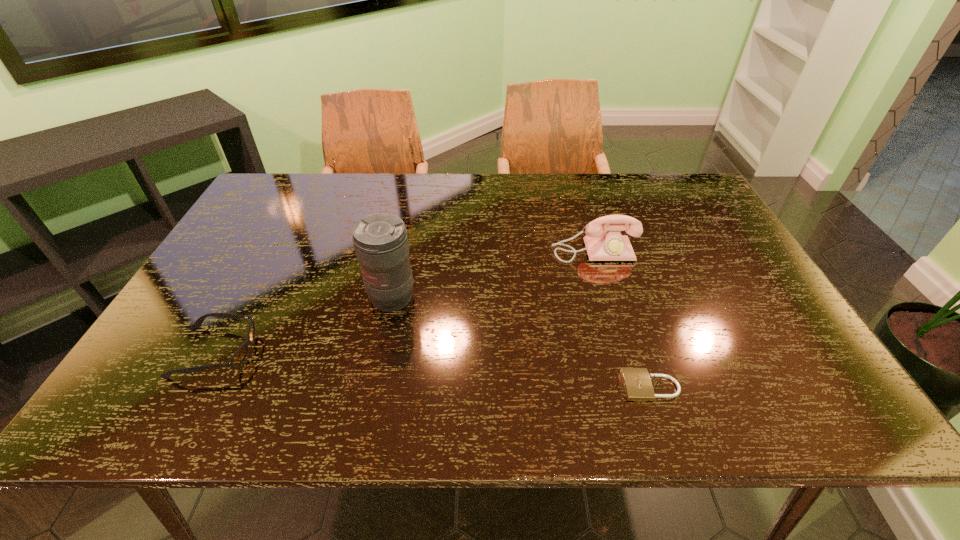
Identify the location of unoccupied area between the farthest object and the padlock. (622, 319).

At what (x,y) coordinates should I click in order to perform the action: click on vacant space that's between the second shortest object and the shortest object. Please return your answer as a coordinate pair (x, y). The width and height of the screenshot is (960, 540). Looking at the image, I should click on (433, 369).

In order to click on vacant space that is in between the second tallest object and the second farthest object in this screenshot , I will do `click(492, 275)`.

Image resolution: width=960 pixels, height=540 pixels. I want to click on unoccupied area between the padlock and the leftmost object, so click(433, 369).

Locate an element on the screen. free area in between the third nearest object and the spectacles is located at coordinates (303, 325).

Where is `vacant space in between the shortest object and the telephoto lens`? Image resolution: width=960 pixels, height=540 pixels. vacant space in between the shortest object and the telephoto lens is located at coordinates (521, 342).

This screenshot has width=960, height=540. I want to click on unoccupied position between the shortest object and the leftmost object, so pos(433,369).

Identify the location of empty location between the shortest object and the tallest object. This screenshot has height=540, width=960. (521, 342).

You are a GUI agent. You are given a task and a screenshot of the screen. Output one action in this format:
    pyautogui.click(x=<x>, y=<y>)
    Task: Click on the second closest object to the telephone
    This screenshot has height=540, width=960.
    Given the screenshot: What is the action you would take?
    pyautogui.click(x=380, y=240)

Locate an element on the screen. This screenshot has width=960, height=540. the closest object to the second shortest object is located at coordinates (380, 240).